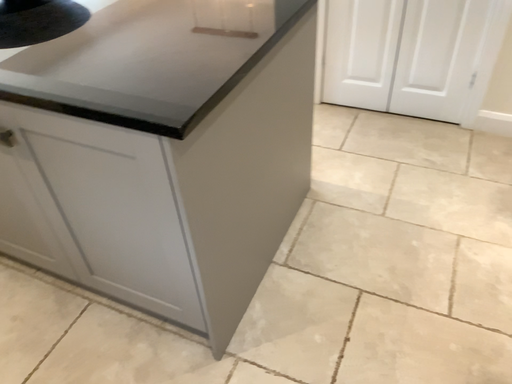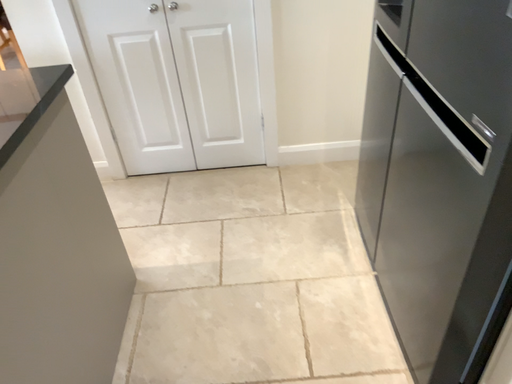
Question: How did the camera likely rotate when shooting the video?

Choices:
 (A) rotated left
 (B) rotated right

Answer: (B)